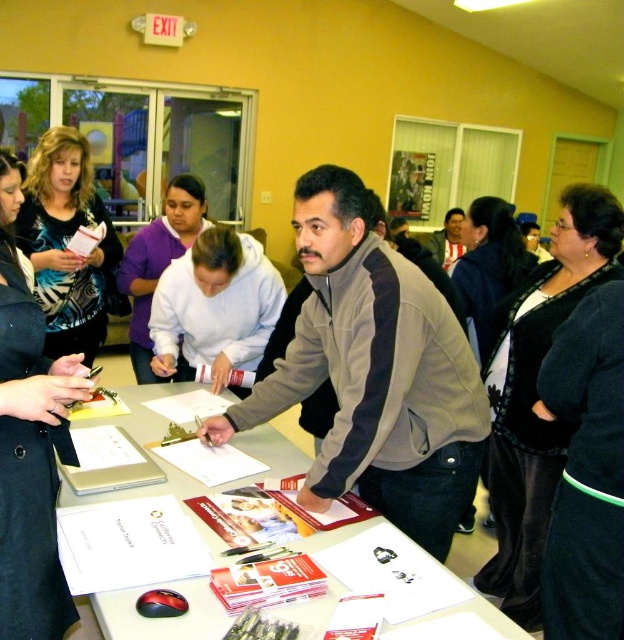
Consider the image. You are a participant at the event and need to retrieve both the black textured sweater at center and the white fleece hoodie at center from the table. Which item should you pick up first to avoid having to move the other one?

You should pick up the white fleece hoodie at center first because the black textured sweater at center is below it, so moving the white fleece hoodie at center first would allow access to the sweater without needing to move the hoodie again.

You are organizing a community event and need to determine which jacket to use for a promotional photo. The white fleece hoodie at center and the matte gray jacket at center are both options. Which one is larger in size?

The white fleece hoodie at center is bigger than the matte gray jacket at center, so it would be the larger option for the promotional photo.